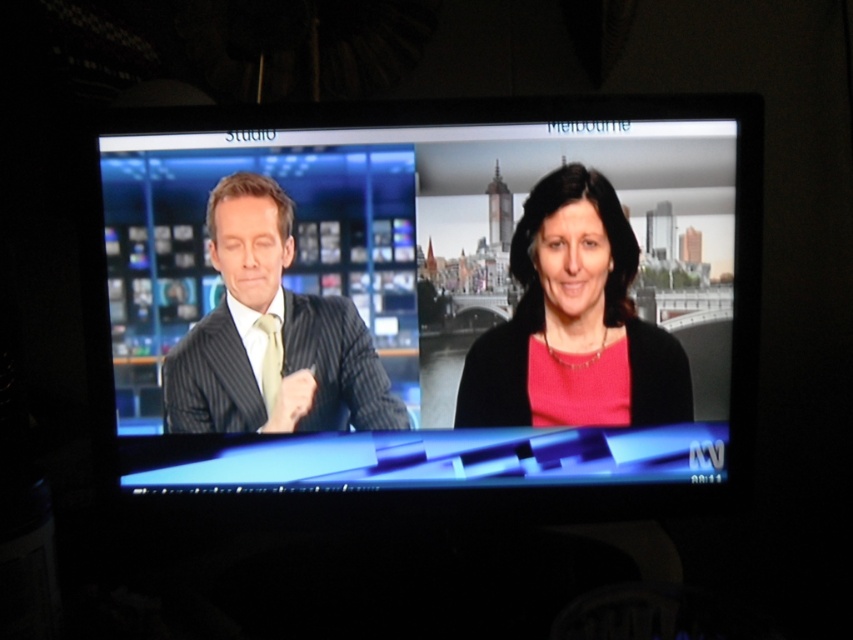
Does matte black suit at center have a greater height compared to pink matte/black sweater at center?

Yes, matte black suit at center is taller than pink matte/black sweater at center.

From the picture: Who is higher up, matte black suit at center or pink matte/black sweater at center?

pink matte/black sweater at center

Measure the distance between matte black suit at center and camera.

matte black suit at center and camera are 33.35 inches apart.

Identify the location of matte black suit at center. The image size is (853, 640). (433, 294).

Consider the image. Is pink matte/black sweater at center taller than pinstriped suit at left?

Yes.

Which is in front, point (573, 364) or point (204, 362)?

Point (204, 362) is more forward.

Locate an element on the screen. The width and height of the screenshot is (853, 640). pink matte/black sweater at center is located at coordinates (573, 323).

Between matte black suit at center and pinstriped suit at left, which one is positioned lower?

pinstriped suit at left is lower down.

Does matte black suit at center appear on the left side of pinstriped suit at left?

In fact, matte black suit at center is to the right of pinstriped suit at left.

Where is `matte black suit at center`? The height and width of the screenshot is (640, 853). matte black suit at center is located at coordinates (433, 294).